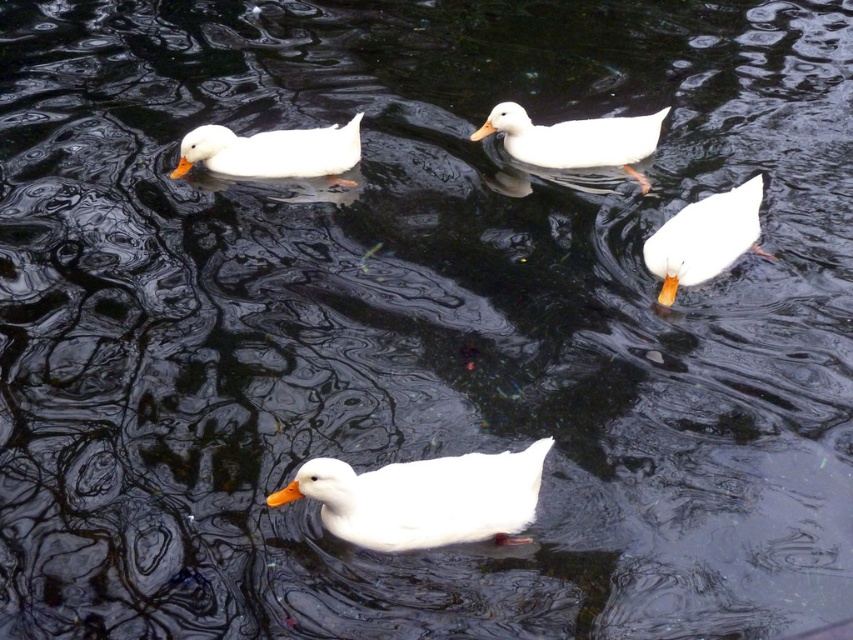
You are observing the scene of four white ducks swimming on a body of water. You notice a white matte duck at center. Where exactly is the white matte duck positioned in the image?

The white matte duck at center is located at point (424, 499).

You are a photographer trying to capture the white matte duck at center in the exact center of your photo. Given its current position at point coordinates, can you confirm if it is already centered?

The white matte duck at center is positioned at coordinates point (424,499), which means it is already centered in the image.